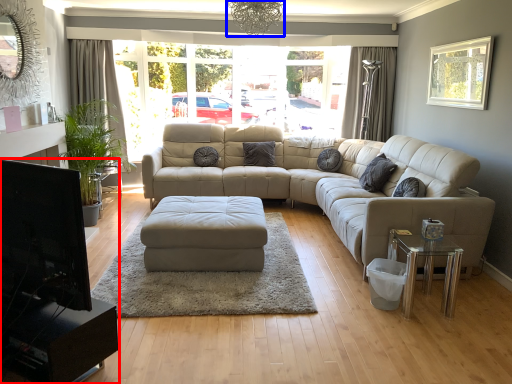
Question: Which point is further to the camera, entertainment center (highlighted by a red box) or light fixture (highlighted by a blue box)?

Choices:
 (A) entertainment center
 (B) light fixture

Answer: (B)